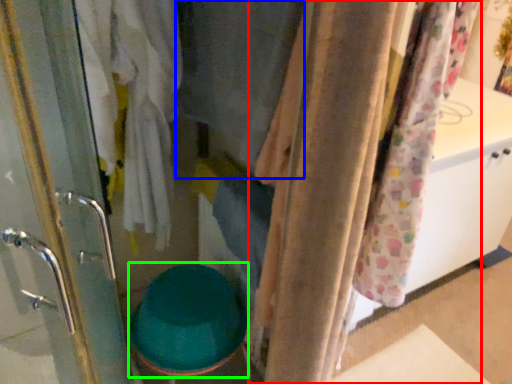
Question: Estimate the real-world distances between objects in this image. Which object is farther from curtain (highlighted by a red box), clothing (highlighted by a blue box) or toilet bowl (highlighted by a green box)?

Choices:
 (A) clothing
 (B) toilet bowl

Answer: (B)